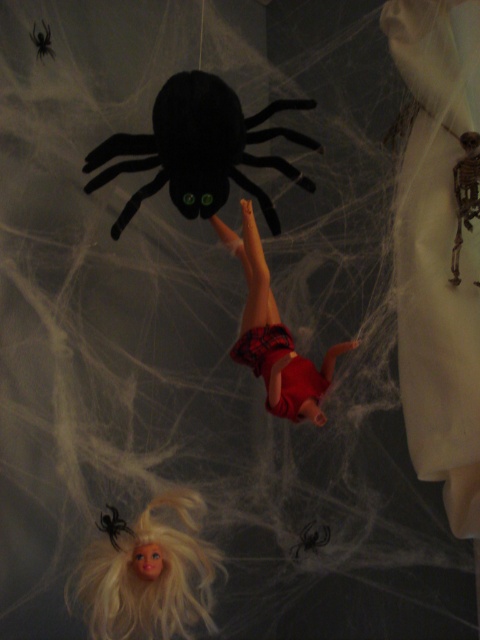
Question: Which point is closer to the camera?

Choices:
 (A) matte red shorts at center
 (B) black fuzzy spider at lower left
 (C) black fuzzy spider at center

Answer: (A)

Question: In this image, where is black fuzzy spider at center located relative to black fuzzy spider at lower left?

Choices:
 (A) below
 (B) above

Answer: (A)

Question: Does black fuzzy spider at center appear on the right side of black fuzzy spider at lower left?

Choices:
 (A) yes
 (B) no

Answer: (A)

Question: Among these points, which one is nearest to the camera?

Choices:
 (A) (248, 257)
 (B) (48, 40)
 (C) (308, 534)

Answer: (A)

Question: Which point is farther to the camera?

Choices:
 (A) black fuzzy spider at lower left
 (B) black fuzzy spider at center
 (C) blonde hair doll at lower left

Answer: (B)

Question: From the image, what is the correct spatial relationship of blonde hair doll at lower left in relation to matte red shorts at center?

Choices:
 (A) left
 (B) right

Answer: (A)